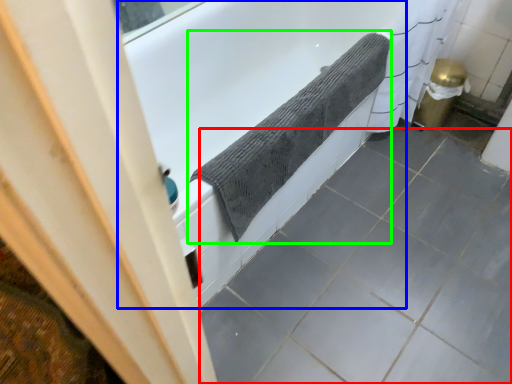
Question: Considering the real-world distances, which object is closest to ceramic tile (highlighted by a red box)? bathtub (highlighted by a blue box) or bath towel (highlighted by a green box).

Choices:
 (A) bathtub
 (B) bath towel

Answer: (B)